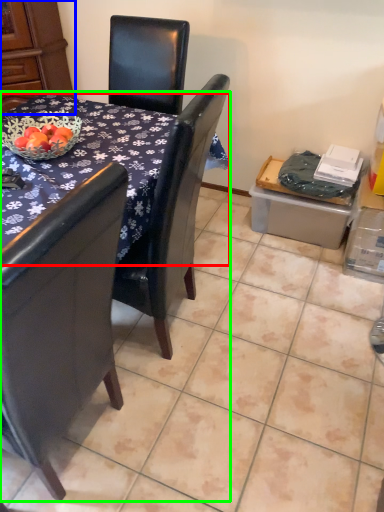
Question: Estimate the real-world distances between objects in this image. Which object is closer to desk (highlighted by a red box), armoire (highlighted by a blue box) or table (highlighted by a green box)?

Choices:
 (A) armoire
 (B) table

Answer: (B)